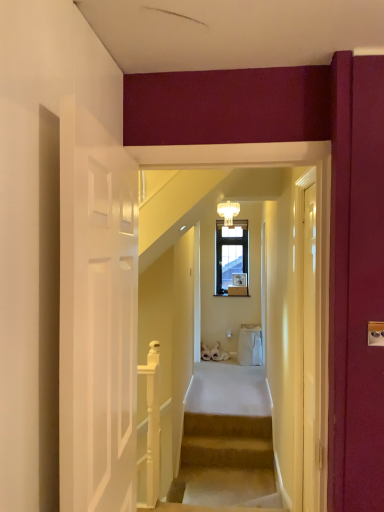
Question: Considering the positions of white glossy wooden handrail at lower left and translucent glass chandelier at upper center in the image, is white glossy wooden handrail at lower left bigger or smaller than translucent glass chandelier at upper center?

Choices:
 (A) small
 (B) big

Answer: (B)

Question: Visually, is white glossy wooden handrail at lower left positioned to the left or to the right of translucent glass chandelier at upper center?

Choices:
 (A) right
 (B) left

Answer: (B)

Question: Which object is the farthest from the translucent glass chandelier at upper center?

Choices:
 (A) white glossy wooden handrail at lower left
 (B) clear glass door at right

Answer: (B)

Question: Estimate the real-world distances between objects in this image. Which object is closer to the clear glass door at right?

Choices:
 (A) translucent glass chandelier at upper center
 (B) white glossy wooden handrail at lower left

Answer: (B)